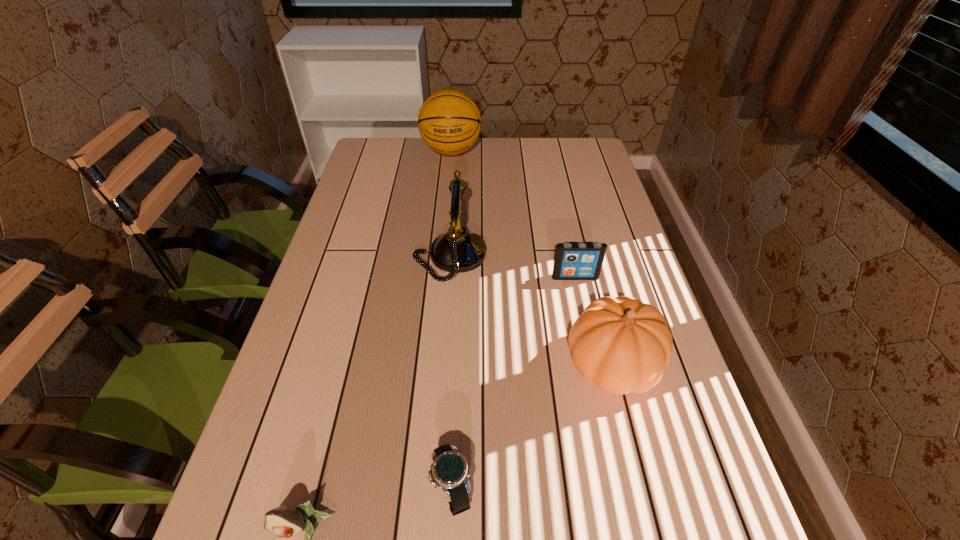
The image size is (960, 540). In order to click on free location that satisfies the following two spatial constraints: 1. on the surface of the farthest object near the brand logo; 2. on the left side of the watch in this screenshot , I will do `click(420, 489)`.

This screenshot has width=960, height=540. I want to click on free region that satisfies the following two spatial constraints: 1. on the back side of the pumpkin; 2. on the left side of the watch, so click(x=457, y=364).